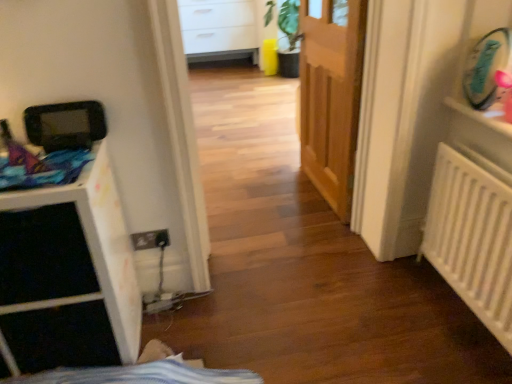
Question: From the image's perspective, would you say white matte file cabinet at left is positioned over wooden door at center?

Choices:
 (A) yes
 (B) no

Answer: (B)

Question: Is wooden door at center a part of white matte file cabinet at left?

Choices:
 (A) yes
 (B) no

Answer: (B)

Question: Can you confirm if white matte file cabinet at left is positioned to the left of wooden door at center?

Choices:
 (A) yes
 (B) no

Answer: (A)

Question: Is white matte file cabinet at left at the right side of wooden door at center?

Choices:
 (A) no
 (B) yes

Answer: (A)

Question: Are white matte file cabinet at left and wooden door at center making contact?

Choices:
 (A) yes
 (B) no

Answer: (B)

Question: Can you confirm if white matte file cabinet at left is smaller than wooden door at center?

Choices:
 (A) yes
 (B) no

Answer: (B)

Question: From the image's perspective, is wooden door at center below white plastic shelf at upper right?

Choices:
 (A) yes
 (B) no

Answer: (B)

Question: Can you confirm if wooden door at center is shorter than white plastic shelf at upper right?

Choices:
 (A) no
 (B) yes

Answer: (A)

Question: Is wooden door at center further to camera compared to white plastic shelf at upper right?

Choices:
 (A) yes
 (B) no

Answer: (A)

Question: Is wooden door at center aimed at white plastic shelf at upper right?

Choices:
 (A) no
 (B) yes

Answer: (A)

Question: Can you confirm if wooden door at center is bigger than white plastic shelf at upper right?

Choices:
 (A) yes
 (B) no

Answer: (A)

Question: Does wooden door at center have a greater width compared to white plastic shelf at upper right?

Choices:
 (A) no
 (B) yes

Answer: (A)

Question: Is white matte radiator at right inside white matte file cabinet at left?

Choices:
 (A) yes
 (B) no

Answer: (B)